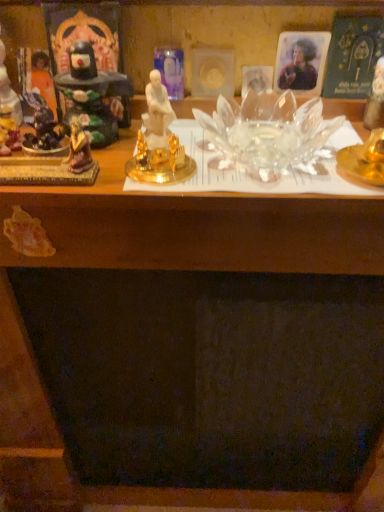
Question: Should I look upward or downward to see transparent glass candle at upper right, acting as the 1th toy starting from the right?

Choices:
 (A) down
 (B) up

Answer: (B)

Question: Is matte purple figurine at left, the second toy positioned from the left, placed right next to matte black statue at left, which is the 4th toy from right to left?

Choices:
 (A) no
 (B) yes

Answer: (B)

Question: Considering the relative sizes of matte purple figurine at left, arranged as the 3th toy when viewed from the right, and matte black statue at left, which is the 1th toy in left-to-right order, in the image provided, is matte purple figurine at left, arranged as the 3th toy when viewed from the right, wider than matte black statue at left, which is the 1th toy in left-to-right order,?

Choices:
 (A) yes
 (B) no

Answer: (B)

Question: From the image's perspective, is matte purple figurine at left, the second toy positioned from the left, below matte black statue at left, which is the 4th toy from right to left?

Choices:
 (A) yes
 (B) no

Answer: (A)

Question: From the image's perspective, would you say matte purple figurine at left, the second toy positioned from the left, is positioned over matte black statue at left, which is the 1th toy in left-to-right order?

Choices:
 (A) no
 (B) yes

Answer: (A)

Question: From a real-world perspective, is matte purple figurine at left, arranged as the 3th toy when viewed from the right, located beneath matte black statue at left, which is the 4th toy from right to left?

Choices:
 (A) yes
 (B) no

Answer: (A)

Question: Would you say matte purple figurine at left, arranged as the 3th toy when viewed from the right, contains matte black statue at left, which is the 4th toy from right to left?

Choices:
 (A) yes
 (B) no

Answer: (B)

Question: Does matte black statue at left, the 2th toy when ordered from right to left, touch orange fabric statue at left, the 2th person when ordered from right to left?

Choices:
 (A) yes
 (B) no

Answer: (A)

Question: Does matte black statue at left, which is counted as the third toy, starting from the left, have a greater width compared to orange fabric statue at left, which ranks as the 1th person in left-to-right order?

Choices:
 (A) no
 (B) yes

Answer: (B)

Question: From a real-world perspective, is matte black statue at left, the 2th toy when ordered from right to left, on top of orange fabric statue at left, which ranks as the 1th person in left-to-right order?

Choices:
 (A) yes
 (B) no

Answer: (A)

Question: Is matte black statue at left, the 2th toy when ordered from right to left, far away from orange fabric statue at left, the 2th person when ordered from right to left?

Choices:
 (A) no
 (B) yes

Answer: (A)

Question: Is matte black statue at left, the 2th toy when ordered from right to left, at the left side of orange fabric statue at left, which ranks as the 1th person in left-to-right order?

Choices:
 (A) yes
 (B) no

Answer: (B)

Question: Is matte black statue at left, which is counted as the third toy, starting from the left, turned away from orange fabric statue at left, the 2th person when ordered from right to left?

Choices:
 (A) no
 (B) yes

Answer: (A)

Question: Is matte black statue at left, which is the 1th toy in left-to-right order, surrounding matte black statue at left, which is counted as the third toy, starting from the left?

Choices:
 (A) no
 (B) yes

Answer: (A)